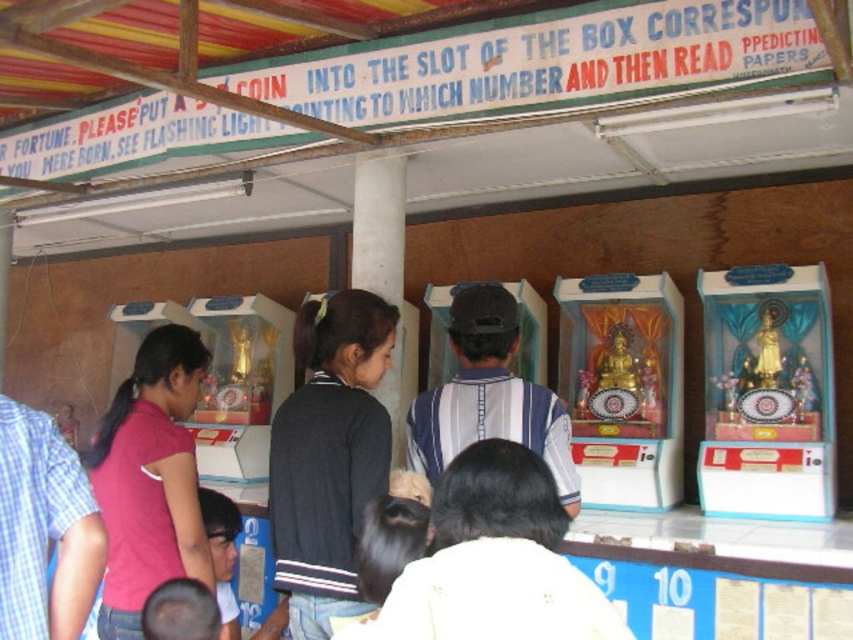
You are at a fortune telling stall and need to place a coin into the slot corresponding to the gold metallic statue at center right. However, you notice a pink fabric shirt at left nearby. Which object is positioned to the right side of the other?

The gold metallic statue at center right is to the right of the pink fabric shirt at left.

You are a customer at the fortune stall and want to choose between the dark gray sweater at center and the pink fabric shirt at left. Which item is more visible to you?

The dark gray sweater at center is more visible because it is positioned over the pink fabric shirt at left, making it appear in front.

You are a tailor measuring shirts for a customer. You have two shirts, the pink fabric shirt at left and the blue plaid shirt at lower left. The customer wants to know if they can fit both shirts into a bag that is 30 inches wide. Can they?

The pink fabric shirt at left and the blue plaid shirt at lower left are 27.70 inches apart, so yes, they can fit both shirts into a bag that is 30 inches wide since the total width required is less than the bag capacity.